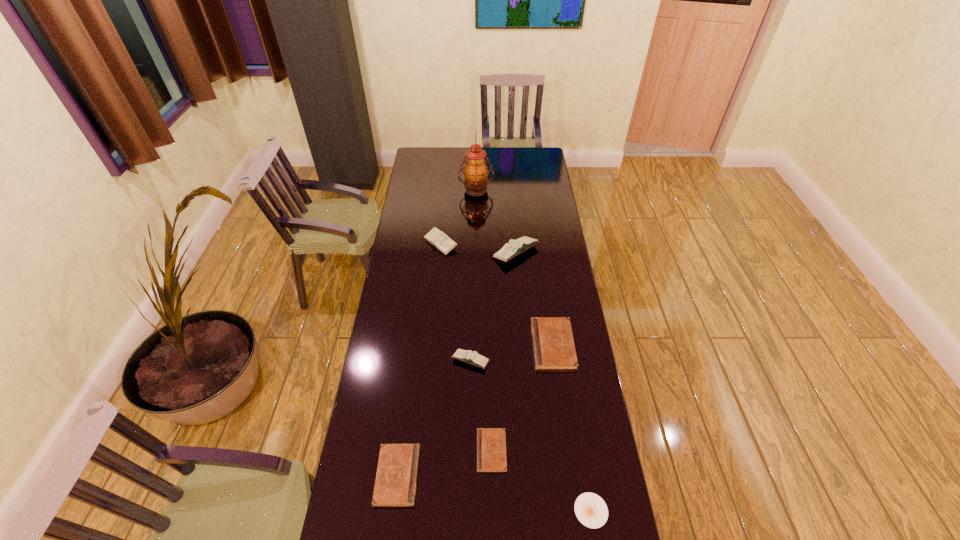
Find the location of a particular element. The image size is (960, 540). vacant area located 0.210m on the spine side of the biggest brown diary is located at coordinates (478, 345).

This screenshot has width=960, height=540. Identify the location of free space located 0.080m on the spine side of the biggest brown diary. point(512,345).

This screenshot has height=540, width=960. I want to click on free space located on the spine side of the biggest brown diary, so click(x=434, y=345).

You are a GUI agent. You are given a task and a screenshot of the screen. Output one action in this format:
    pyautogui.click(x=<x>, y=<y>)
    Task: Click on the vacant region located on the spine side of the second smallest brown diary
    The image size is (960, 540).
    Given the screenshot: What is the action you would take?
    pyautogui.click(x=547, y=475)

The height and width of the screenshot is (540, 960). What are the coordinates of `vacant space located on the spine side of the second brown diary from right to left` in the screenshot? It's located at (455, 450).

You are a GUI agent. You are given a task and a screenshot of the screen. Output one action in this format:
    pyautogui.click(x=<x>, y=<y>)
    Task: Click on the vacant space located 0.370m on the spine side of the second brown diary from right to left
    
    Given the screenshot: What is the action you would take?
    pyautogui.click(x=362, y=450)

Where is `vacant area situated on the spine side of the second brown diary from right to left`? This screenshot has width=960, height=540. vacant area situated on the spine side of the second brown diary from right to left is located at coordinates (445, 450).

At what (x,y) coordinates should I click in order to perform the action: click on free space located on the back of the egg yolk. Please return your answer as a coordinate pair (x, y). Image resolution: width=960 pixels, height=540 pixels. Looking at the image, I should click on (585, 469).

Where is `egg yolk at the right edge`? Image resolution: width=960 pixels, height=540 pixels. egg yolk at the right edge is located at coordinates (591, 510).

The width and height of the screenshot is (960, 540). Identify the location of free region at the left edge. (349, 532).